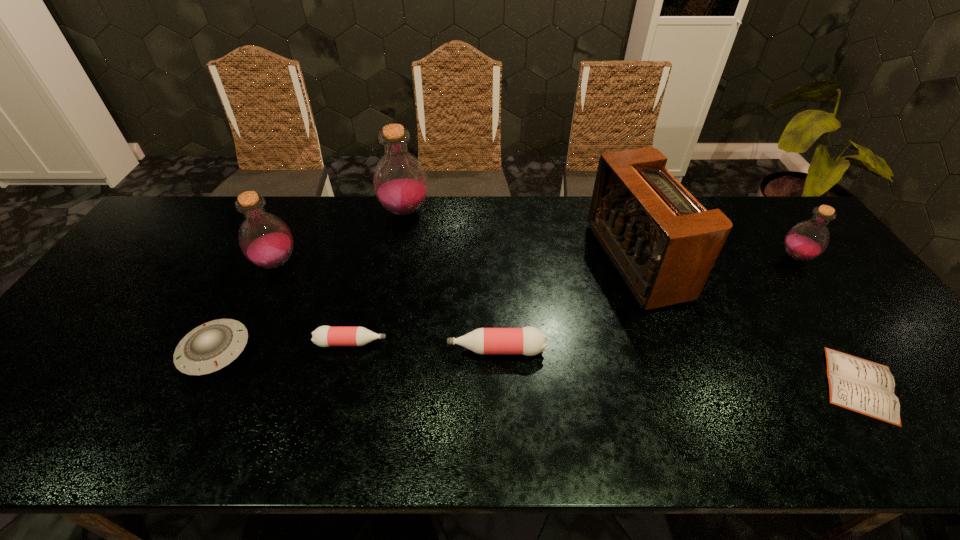
I want to click on the smaller pink bottle, so pyautogui.click(x=324, y=336).

You are a GUI agent. You are given a task and a screenshot of the screen. Output one action in this format:
    pyautogui.click(x=<x>, y=<y>)
    Task: Click on the saucer
    This screenshot has width=960, height=540.
    Given the screenshot: What is the action you would take?
    pyautogui.click(x=211, y=346)

You are a GUI agent. You are given a task and a screenshot of the screen. Output one action in this format:
    pyautogui.click(x=<x>, y=<y>)
    Task: Click on the white diary
    This screenshot has width=960, height=540.
    Given the screenshot: What is the action you would take?
    pyautogui.click(x=856, y=384)

At what (x,y) coordinates should I click in order to perform the action: click on the shortest object. Please return your answer as a coordinate pair (x, y). The image size is (960, 540). Looking at the image, I should click on (856, 384).

This screenshot has height=540, width=960. Identify the location of vacant space located 0.140m on the right of the biggest purple bottle. (472, 212).

At what (x,y) coordinates should I click in order to perform the action: click on blank area located on the right of the sixth object from left to right. Please return your answer as a coordinate pair (x, y). The height and width of the screenshot is (540, 960). Looking at the image, I should click on (696, 261).

You are a GUI agent. You are given a task and a screenshot of the screen. Output one action in this format:
    pyautogui.click(x=<x>, y=<y>)
    Task: Click on the free location located 0.190m on the right of the second smallest purple bottle
    The height and width of the screenshot is (540, 960).
    Given the screenshot: What is the action you would take?
    pyautogui.click(x=364, y=264)

Where is `free region located 0.080m on the front of the smallest purple bottle`? This screenshot has width=960, height=540. free region located 0.080m on the front of the smallest purple bottle is located at coordinates (819, 289).

Find the location of `blank space located with the cap open on the bigger pink bottle`. blank space located with the cap open on the bigger pink bottle is located at coordinates (379, 350).

Identify the location of vacant position located 0.270m with the cap open on the bigger pink bottle. (339, 350).